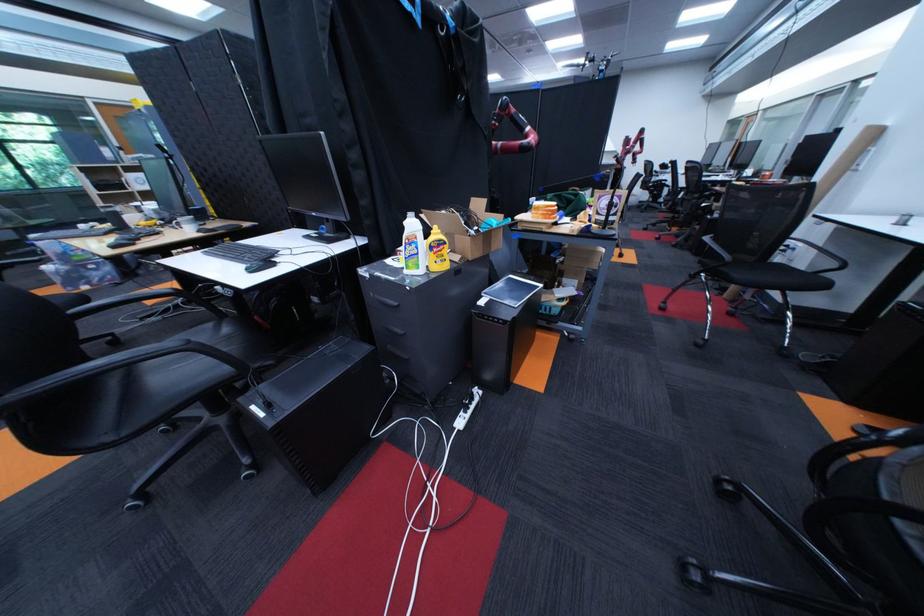
Image resolution: width=924 pixels, height=616 pixels. What do you see at coordinates (390, 306) in the screenshot?
I see `the grey drawer handle` at bounding box center [390, 306].